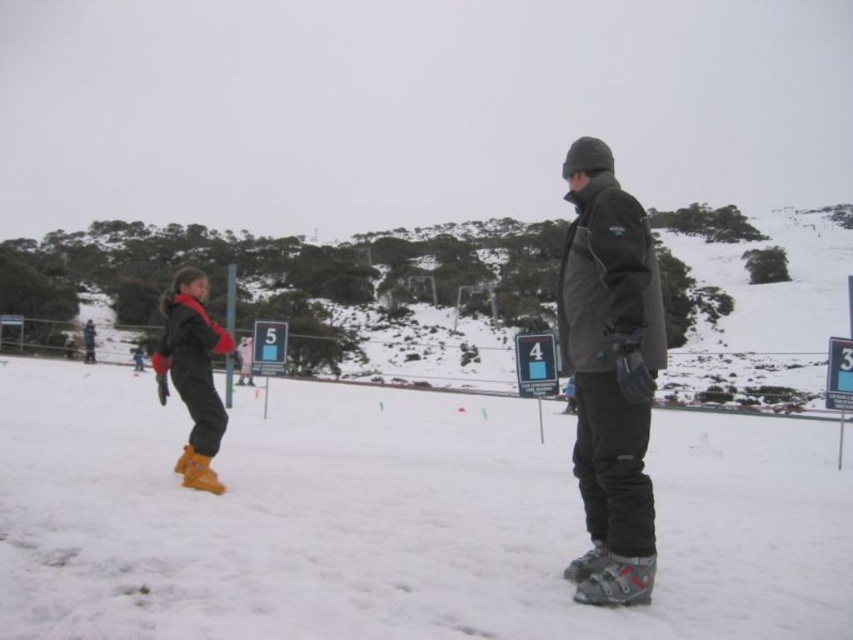
Does snowy ski slope at center have a lesser width compared to matte yellow ski boots at lower left?

No.

Does snowy ski slope at center have a larger size compared to matte yellow ski boots at lower left?

Incorrect, snowy ski slope at center is not larger than matte yellow ski boots at lower left.

Is point (91, 432) positioned in front of point (201, 472)?

No, (91, 432) is further to viewer.

You are a GUI agent. You are given a task and a screenshot of the screen. Output one action in this format:
    pyautogui.click(x=<x>, y=<y>)
    Task: Click on the snowy ski slope at center
    This screenshot has height=640, width=853.
    Given the screenshot: What is the action you would take?
    pyautogui.click(x=393, y=518)

Is point (460, 326) more distant than point (646, 506)?

Yes, point (460, 326) is behind point (646, 506).

The image size is (853, 640). Describe the element at coordinates (305, 292) in the screenshot. I see `snowy ski slope at left` at that location.

Which is in front, point (236, 282) or point (590, 440)?

Point (590, 440)

What are the coordinates of `snowy ski slope at left` in the screenshot? It's located at (305, 292).

Who is higher up, snowy ski slope at center or dark gray matte jacket at center?

dark gray matte jacket at center

From the picture: Is snowy ski slope at center smaller than dark gray matte jacket at center?

No, snowy ski slope at center is not smaller than dark gray matte jacket at center.

This screenshot has width=853, height=640. What do you see at coordinates (393, 518) in the screenshot?
I see `snowy ski slope at center` at bounding box center [393, 518].

Where is `snowy ski slope at center`? The image size is (853, 640). snowy ski slope at center is located at coordinates (393, 518).